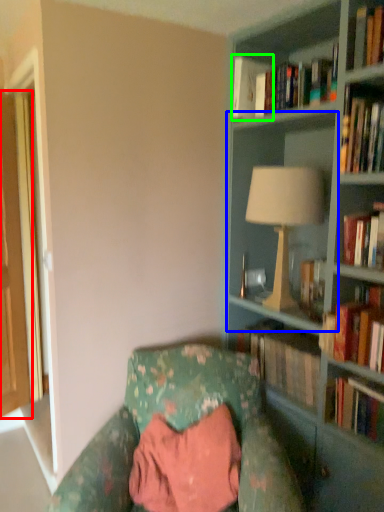
Question: Considering the real-world distances, which object is farthest from glass door (highlighted by a red box)? shelf (highlighted by a blue box) or book (highlighted by a green box)?

Choices:
 (A) shelf
 (B) book

Answer: (A)